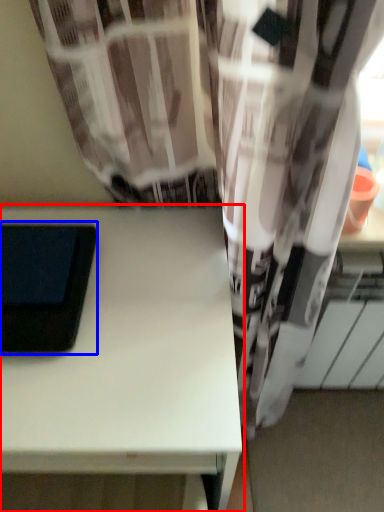
Question: Which point is closer to the camera, table (highlighted by a red box) or ipad (highlighted by a blue box)?

Choices:
 (A) table
 (B) ipad

Answer: (A)